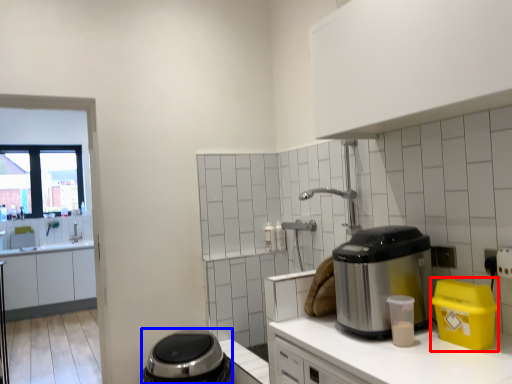
Question: Which point is closer to the camera, appliance (highlighted by a red box) or appliance (highlighted by a blue box)?

Choices:
 (A) appliance
 (B) appliance

Answer: (A)